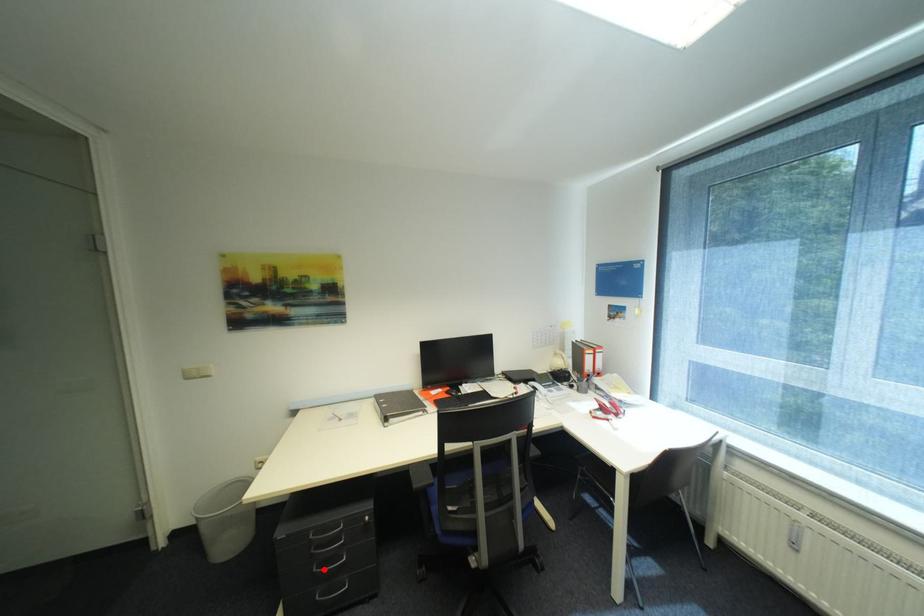
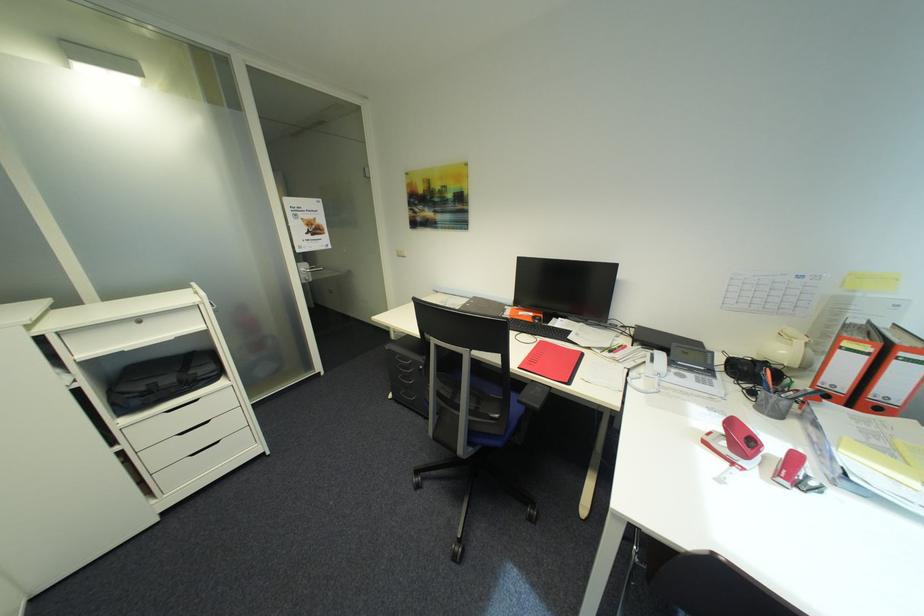
Find the pixel in the second image that matches the highlighted location in the first image.

(408, 378)